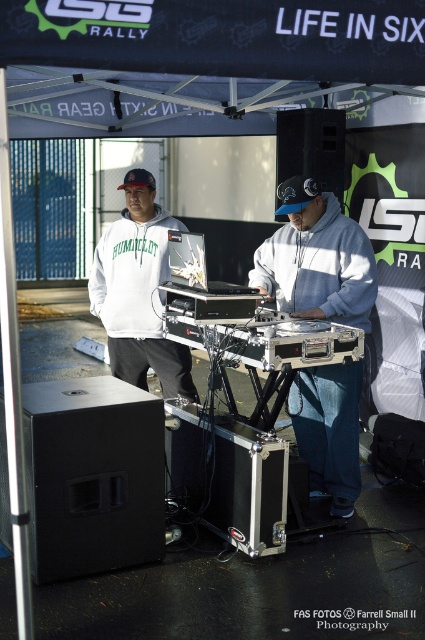
Which is more to the left, gray matte hoodie at center or white matte hoodie at center?

white matte hoodie at center is more to the left.

Is gray matte hoodie at center to the left of white matte hoodie at center from the viewer's perspective?

Incorrect, gray matte hoodie at center is not on the left side of white matte hoodie at center.

Does point (255, 276) lie in front of point (125, 234)?

Yes, it is.

At what (x,y) coordinates should I click in order to perform the action: click on gray matte hoodie at center. Please return your answer as a coordinate pair (x, y). Looking at the image, I should click on (317, 259).